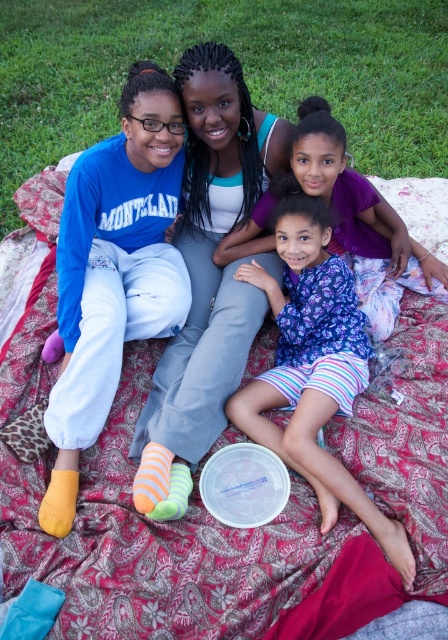
Who is positioned more to the right, matte white tank top at center or floral fabric dress at center?

From the viewer's perspective, floral fabric dress at center appears more on the right side.

Measure the distance between matte white tank top at center and camera.

A distance of 7.13 feet exists between matte white tank top at center and camera.

Between point (156, 493) and point (305, 282), which one is positioned in front?

Point (156, 493)

I want to click on matte white tank top at center, so click(x=206, y=276).

Who is more distant from viewer, (340,99) or (136,438)?

Positioned behind is point (340,99).

Is green grass at upper center to the left of matte white tank top at center from the viewer's perspective?

Incorrect, green grass at upper center is not on the left side of matte white tank top at center.

Identify the location of green grass at upper center. This screenshot has height=640, width=448. 242,68.

Between point (270, 378) and point (339, 227), which one is positioned behind?

Positioned behind is point (339, 227).

Does floral fabric dress at center appear over purple floral dress at center?

Actually, floral fabric dress at center is below purple floral dress at center.

Which is behind, point (262, 404) or point (326, 102)?

Positioned behind is point (326, 102).

At what (x,y) coordinates should I click in order to perform the action: click on floral fabric dress at center. Please return your answer as a coordinate pair (x, y). The image size is (448, 640). Looking at the image, I should click on (314, 369).